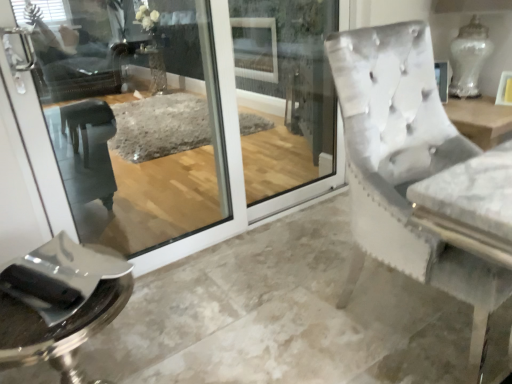
Question: In terms of size, does clear glass screen door at center appear bigger or smaller than polished chrome tray at lower left?

Choices:
 (A) small
 (B) big

Answer: (B)

Question: Considering the positions of clear glass screen door at center and polished chrome tray at lower left in the image, is clear glass screen door at center taller or shorter than polished chrome tray at lower left?

Choices:
 (A) short
 (B) tall

Answer: (B)

Question: In the image, is clear glass screen door at center positioned in front of or behind polished chrome tray at lower left?

Choices:
 (A) front
 (B) behind

Answer: (B)

Question: In the image, is polished chrome tray at lower left positioned in front of or behind clear glass screen door at center?

Choices:
 (A) front
 (B) behind

Answer: (A)

Question: Is polished chrome tray at lower left to the left or to the right of clear glass screen door at center in the image?

Choices:
 (A) right
 (B) left

Answer: (B)

Question: Is polished chrome tray at lower left taller or shorter than clear glass screen door at center?

Choices:
 (A) short
 (B) tall

Answer: (A)

Question: From the image's perspective, is polished chrome tray at lower left above or below clear glass screen door at center?

Choices:
 (A) above
 (B) below

Answer: (B)